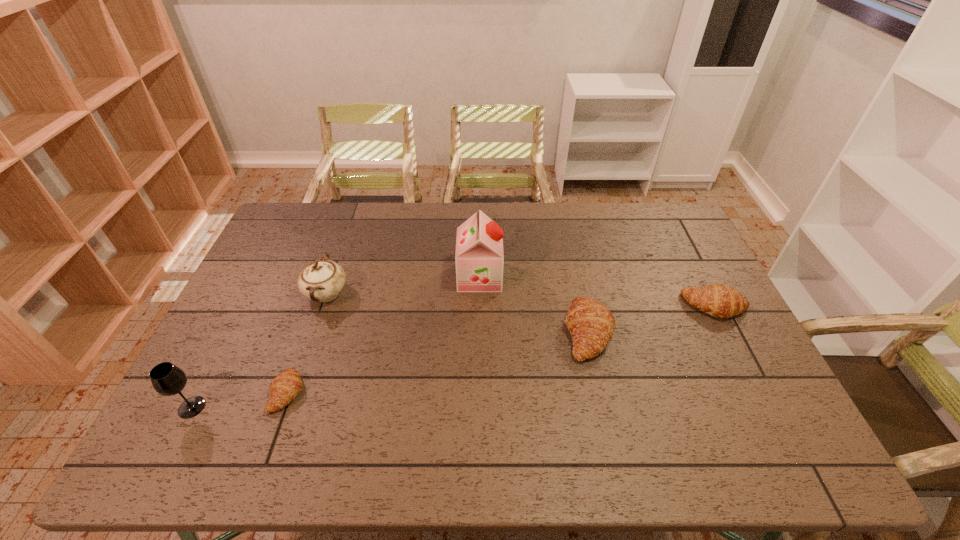
To achieve uniform spacing by inserting another crescent_roll among them, please point to a free space for this new crescent_roll. Please provide its 2D coordinates. Your answer should be formatted as a tuple, i.e. [(x, y)], where the tuple contains the x and y coordinates of a point satisfying the conditions above.

[(446, 360)]